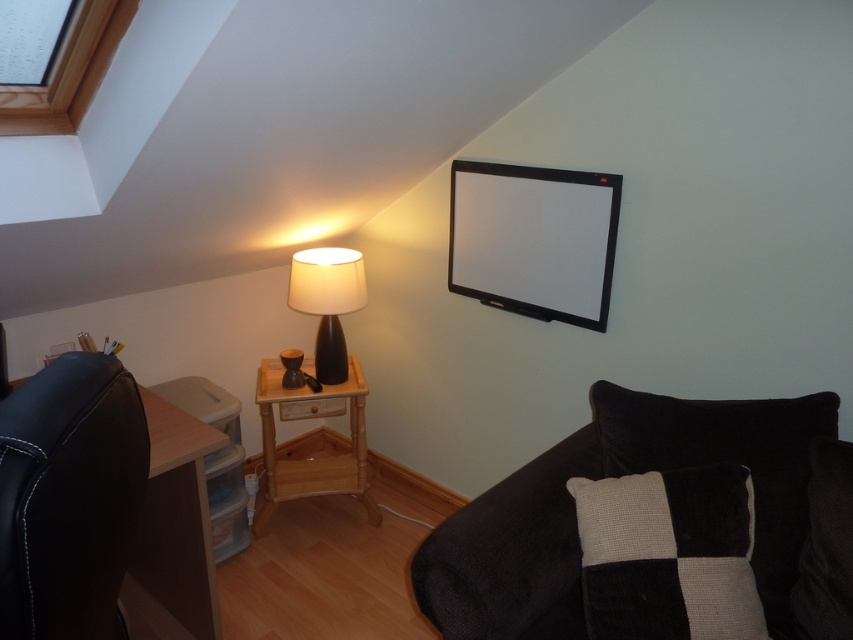
Is velvet black couch at lower right to the right of matte black lamp at center from the viewer's perspective?

Yes, velvet black couch at lower right is to the right of matte black lamp at center.

Is velvet black couch at lower right taller than matte black lamp at center?

No.

Is point (468, 525) less distant than point (340, 294)?

Yes, point (468, 525) is in front of point (340, 294).

At what (x,y) coordinates should I click in order to perform the action: click on velvet black couch at lower right. Please return your answer as a coordinate pair (x, y). Looking at the image, I should click on (616, 476).

Who is higher up, velvet black couch at lower right or black textured pillow at lower right?

velvet black couch at lower right is above.

Where is `velvet black couch at lower right`? The height and width of the screenshot is (640, 853). velvet black couch at lower right is located at coordinates (616, 476).

What do you see at coordinates (616, 476) in the screenshot?
I see `velvet black couch at lower right` at bounding box center [616, 476].

I want to click on velvet black couch at lower right, so click(616, 476).

Is black leather swivel chair at lower left wider than transparent glass window at upper left?

No, black leather swivel chair at lower left is not wider than transparent glass window at upper left.

Is the position of black leather swivel chair at lower left less distant than that of transparent glass window at upper left?

That is True.

Is point (28, 557) closer to viewer compared to point (9, 108)?

Yes, point (28, 557) is in front of point (9, 108).

In order to click on black leather swivel chair at lower left in this screenshot , I will do `click(68, 497)`.